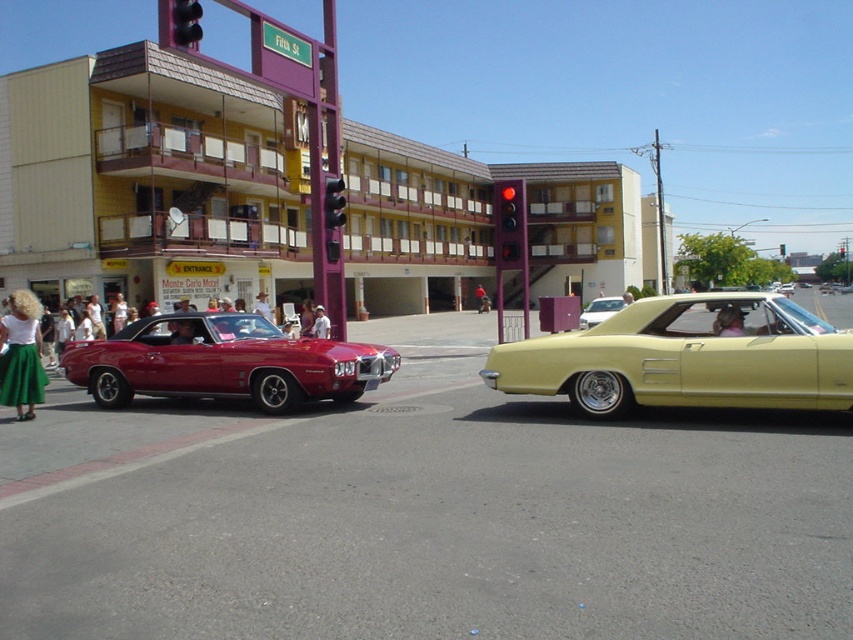
Is point (500, 246) farther from camera compared to point (618, 301)?

No.

What do you see at coordinates (509, 225) in the screenshot?
I see `red glass traffic light at center` at bounding box center [509, 225].

Is point (521, 257) behind point (622, 301)?

No.

Where is `red glass traffic light at center`? The height and width of the screenshot is (640, 853). red glass traffic light at center is located at coordinates (509, 225).

The width and height of the screenshot is (853, 640). In order to click on matte red car at left in this screenshot , I will do `click(224, 362)`.

Measure the distance from matte red car at left to metallic red traffic light at upper center.

The distance of matte red car at left from metallic red traffic light at upper center is 5.95 meters.

Between matte red car at left and metallic red traffic light at upper center, which one has less height?

Standing shorter between the two is metallic red traffic light at upper center.

Image resolution: width=853 pixels, height=640 pixels. I want to click on matte red car at left, so click(x=224, y=362).